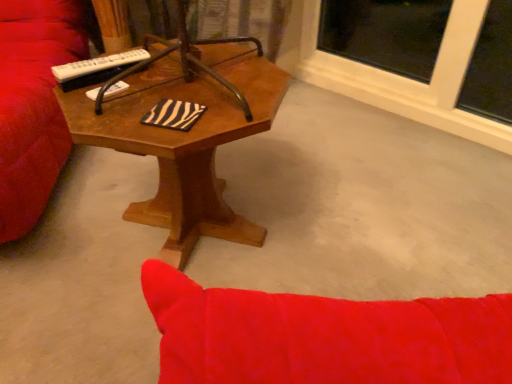
I want to click on vacant space in front of white plastic remote at upper left, so click(103, 111).